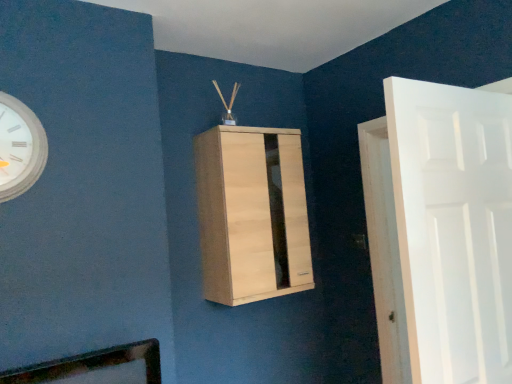
Question: Is light wood cabinet at center positioned with its back to white matte door at right?

Choices:
 (A) no
 (B) yes

Answer: (A)

Question: Does light wood cabinet at center have a greater width compared to white matte door at right?

Choices:
 (A) yes
 (B) no

Answer: (A)

Question: From the image's perspective, is light wood cabinet at center over white matte door at right?

Choices:
 (A) no
 (B) yes

Answer: (B)

Question: Could you tell me if light wood cabinet at center is facing white matte door at right?

Choices:
 (A) no
 (B) yes

Answer: (B)

Question: Are light wood cabinet at center and white matte door at right making contact?

Choices:
 (A) yes
 (B) no

Answer: (B)

Question: Considering the positions of light wood cabinet at center and white matte clock at upper left in the image, is light wood cabinet at center bigger or smaller than white matte clock at upper left?

Choices:
 (A) big
 (B) small

Answer: (A)

Question: Do you think light wood cabinet at center is within white matte clock at upper left, or outside of it?

Choices:
 (A) inside
 (B) outside

Answer: (B)

Question: From a real-world perspective, is light wood cabinet at center physically located above or below white matte clock at upper left?

Choices:
 (A) above
 (B) below

Answer: (B)

Question: Is light wood cabinet at center wider or thinner than white matte clock at upper left?

Choices:
 (A) wide
 (B) thin

Answer: (A)

Question: From their relative heights in the image, would you say white matte door at right is taller or shorter than light wood cabinet at center?

Choices:
 (A) tall
 (B) short

Answer: (A)

Question: Does point (439, 231) appear closer or farther from the camera than point (249, 132)?

Choices:
 (A) farther
 (B) closer

Answer: (B)

Question: In terms of width, does white matte door at right look wider or thinner when compared to light wood cabinet at center?

Choices:
 (A) thin
 (B) wide

Answer: (A)

Question: Do you think white matte door at right is within light wood cabinet at center, or outside of it?

Choices:
 (A) inside
 (B) outside

Answer: (B)

Question: Based on their positions, is white matte door at right located to the left or right of white matte clock at upper left?

Choices:
 (A) left
 (B) right

Answer: (B)

Question: Is white matte door at right bigger or smaller than white matte clock at upper left?

Choices:
 (A) big
 (B) small

Answer: (A)